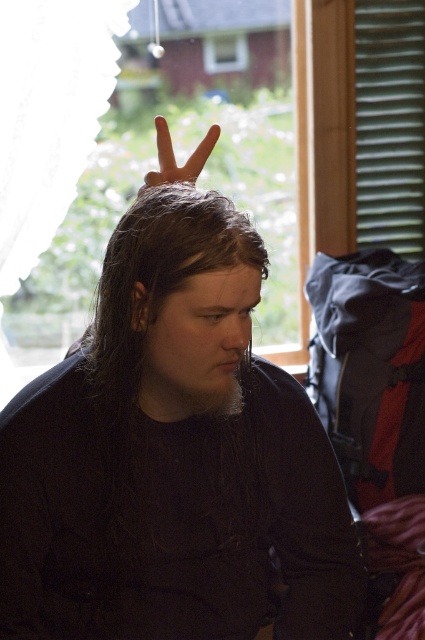
You are taking a photo of the scene and want to focus on both the point at coordinates point (146, 554) and point (138, 342). Which point should you adjust your focus to first to ensure both are in clear view?

You should focus on point (138, 342) first because it is closer to the camera than point (146, 554). By focusing on the closer point, the farther point will also come into focus due to the depth of field.

Where is the dark brown hair at center located in the image?

The dark brown hair at center is located at point (159, 272) in the image.